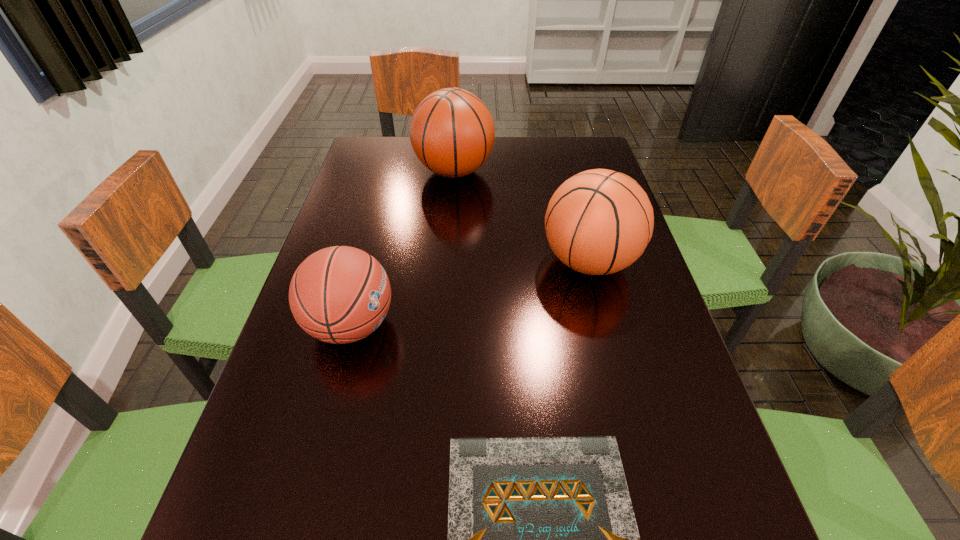
At what (x,y) coordinates should I click in order to perform the action: click on vacant point at the right edge. Please return your answer as a coordinate pair (x, y). The image size is (960, 540). Looking at the image, I should click on (607, 344).

Locate an element on the screen. vacant space at the far right corner is located at coordinates (564, 171).

I want to click on free point between the farthest basketball and the shortest basketball, so click(403, 248).

Where is `free space between the farthest basketball and the second shortest object`? free space between the farthest basketball and the second shortest object is located at coordinates click(403, 248).

Where is `object that is the third closest one to the third tallest object`? This screenshot has height=540, width=960. object that is the third closest one to the third tallest object is located at coordinates (452, 132).

Select which object is the second closest to the rightmost basketball. Please provide its 2D coordinates. Your answer should be formatted as a tuple, i.e. [(x, y)], where the tuple contains the x and y coordinates of a point satisfying the conditions above.

[(340, 294)]

Where is `the closest basketball to the second shortest object`? The width and height of the screenshot is (960, 540). the closest basketball to the second shortest object is located at coordinates (600, 221).

Identify which basketball is the nearest to the shortest basketball. Please provide its 2D coordinates. Your answer should be formatted as a tuple, i.e. [(x, y)], where the tuple contains the x and y coordinates of a point satisfying the conditions above.

[(600, 221)]

Where is `vacant area that satisfies the following two spatial constraints: 1. on the front side of the rightmost basketball; 2. on the logo side of the second shortest object`? The height and width of the screenshot is (540, 960). vacant area that satisfies the following two spatial constraints: 1. on the front side of the rightmost basketball; 2. on the logo side of the second shortest object is located at coordinates (605, 325).